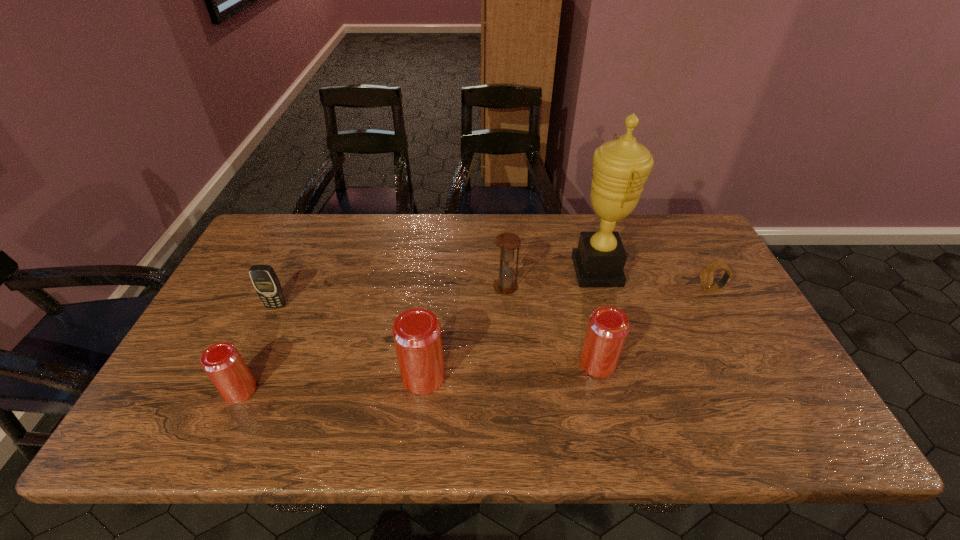
You are a GUI agent. You are given a task and a screenshot of the screen. Output one action in this format:
    pyautogui.click(x=<x>, y=<y>)
    Task: Click on the vacant region between the hourglass and the shortest beer can
    This screenshot has height=540, width=960.
    Given the screenshot: What is the action you would take?
    pyautogui.click(x=372, y=339)

Image resolution: width=960 pixels, height=540 pixels. In order to click on vacant point located between the second tallest beer can and the watch in this screenshot , I will do `click(654, 327)`.

Locate an element on the screen. free area in between the trophy cup and the fourth object from left to right is located at coordinates coord(551,279).

The image size is (960, 540). What are the coordinates of `free spot between the second beer can from left to right and the shortest beer can` in the screenshot? It's located at (332, 383).

You are a GUI agent. You are given a task and a screenshot of the screen. Output one action in this format:
    pyautogui.click(x=<x>, y=<y>)
    Task: Click on the free area in between the second shortest beer can and the fourth object from left to right
    This screenshot has width=960, height=540.
    Given the screenshot: What is the action you would take?
    pyautogui.click(x=551, y=326)

This screenshot has width=960, height=540. I want to click on empty space that is in between the shortest object and the trophy cup, so click(654, 280).

Where is `unoccupied position between the shortest beer can and the fifth object from right to left`? This screenshot has height=540, width=960. unoccupied position between the shortest beer can and the fifth object from right to left is located at coordinates (332, 383).

Select which object appears as the fourth closest to the hourglass. Please provide its 2D coordinates. Your answer should be formatted as a tuple, i.e. [(x, y)], where the tuple contains the x and y coordinates of a point satisfying the conditions above.

[(706, 274)]

Locate which object is the fifth closest to the third object from left to right. Please provide its 2D coordinates. Your answer should be formatted as a tuple, i.e. [(x, y)], where the tuple contains the x and y coordinates of a point satisfying the conditions above.

[(620, 167)]

Select which beer can appears as the closest to the trophy cup. Please provide its 2D coordinates. Your answer should be formatted as a tuple, i.e. [(x, y)], where the tuple contains the x and y coordinates of a point satisfying the conditions above.

[(607, 329)]